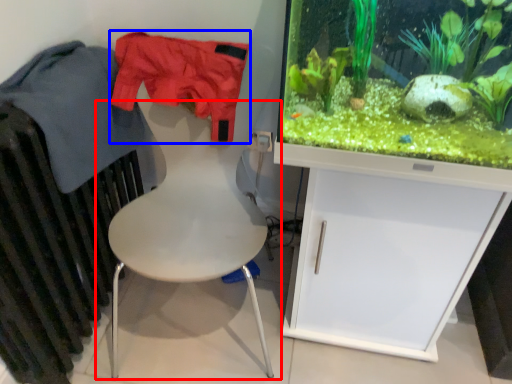
Question: Which object is further to the camera taking this photo, chair (highlighted by a red box) or clothing (highlighted by a blue box)?

Choices:
 (A) chair
 (B) clothing

Answer: (B)